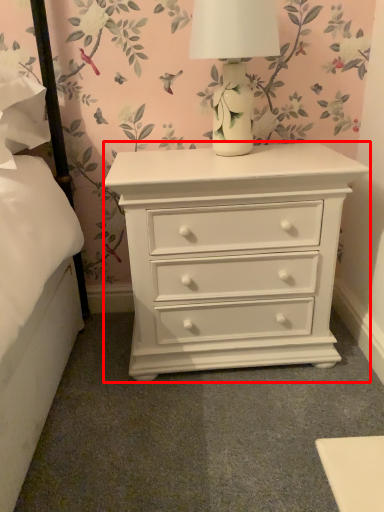
Question: From the image, what is the correct spatial relationship of nightstand (annotated by the red box) in relation to table lamp?

Choices:
 (A) right
 (B) left

Answer: (A)